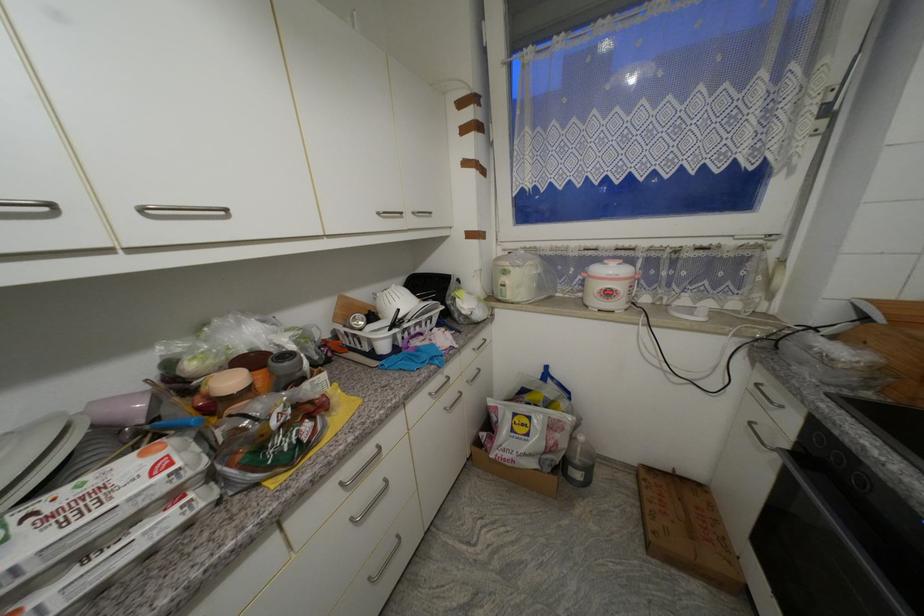
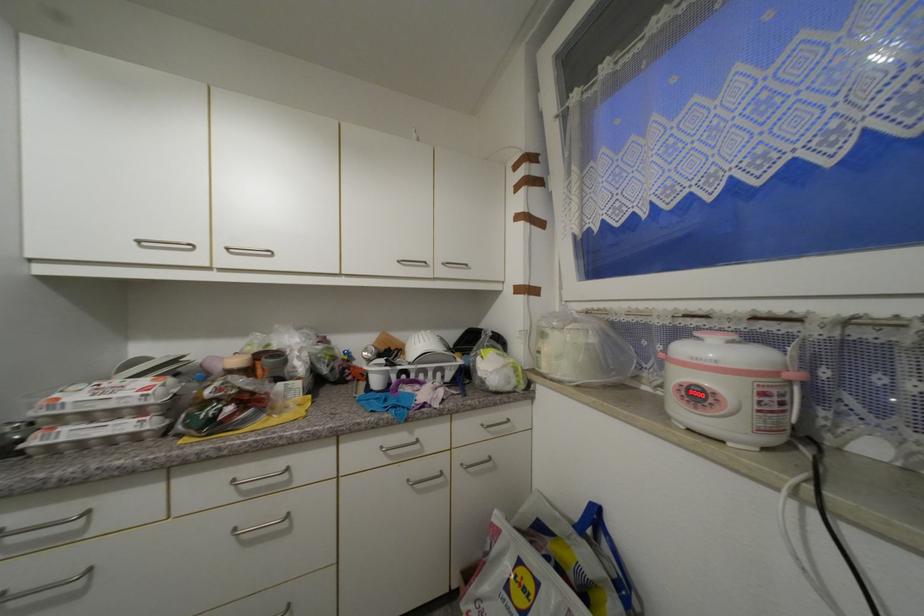
Locate, in the second image, the point that corresponds to (x=574, y=394) in the first image.

(636, 588)